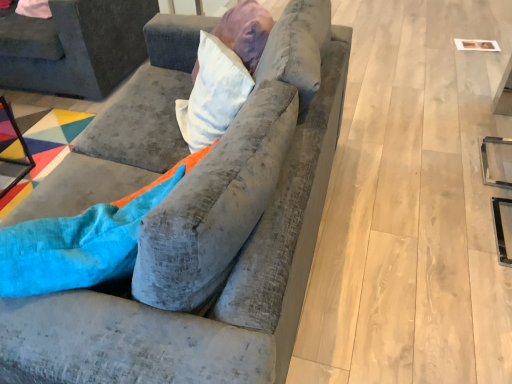
Question: Is velvet gray couch at center, placed as the second studio couch when sorted from left to right, facing towards velvet gray couch at upper left, marked as the 2th studio couch in a right-to-left arrangement?

Choices:
 (A) no
 (B) yes

Answer: (B)

Question: Is velvet gray couch at center, which is counted as the first studio couch, starting from the right, bigger than velvet gray couch at upper left, marked as the 2th studio couch in a right-to-left arrangement?

Choices:
 (A) yes
 (B) no

Answer: (A)

Question: Is velvet gray couch at center, acting as the 1th studio couch starting from the front, with velvet gray couch at upper left, the 1th studio couch from the back?

Choices:
 (A) no
 (B) yes

Answer: (A)

Question: Is velvet gray couch at center, placed as the second studio couch when sorted from left to right, further to the viewer compared to velvet gray couch at upper left, marked as the 2th studio couch in a right-to-left arrangement?

Choices:
 (A) no
 (B) yes

Answer: (A)

Question: Is velvet gray couch at center, the 2th studio couch positioned from the back, located outside velvet gray couch at upper left, the 1th studio couch from the back?

Choices:
 (A) yes
 (B) no

Answer: (A)

Question: From a real-world perspective, is velvet gray couch at center, which is counted as the first studio couch, starting from the right, positioned over velvet gray couch at upper left, marked as the second studio couch in a front-to-back arrangement, based on gravity?

Choices:
 (A) no
 (B) yes

Answer: (B)

Question: Does velvet gray couch at upper left, marked as the second studio couch in a front-to-back arrangement, appear on the right side of velvet gray couch at center, the 2th studio couch positioned from the back?

Choices:
 (A) no
 (B) yes

Answer: (A)

Question: From the image's perspective, does velvet gray couch at upper left, the 1th studio couch from the back, appear lower than velvet gray couch at center, the 2th studio couch positioned from the back?

Choices:
 (A) yes
 (B) no

Answer: (B)

Question: Is velvet gray couch at upper left, which ranks as the first studio couch in left-to-right order, shorter than velvet gray couch at center, the 2th studio couch positioned from the back?

Choices:
 (A) no
 (B) yes

Answer: (B)

Question: Is velvet gray couch at upper left, the 1th studio couch from the back, surrounding velvet gray couch at center, which is counted as the first studio couch, starting from the right?

Choices:
 (A) yes
 (B) no

Answer: (B)

Question: From a real-world perspective, is velvet gray couch at upper left, marked as the second studio couch in a front-to-back arrangement, positioned under velvet gray couch at center, acting as the 1th studio couch starting from the front, based on gravity?

Choices:
 (A) no
 (B) yes

Answer: (B)

Question: Can you confirm if velvet gray couch at upper left, which ranks as the first studio couch in left-to-right order, is bigger than velvet gray couch at center, which is counted as the first studio couch, starting from the right?

Choices:
 (A) yes
 (B) no

Answer: (B)

Question: Considering the positions of velvet gray couch at center, placed as the second studio couch when sorted from left to right, and velvet gray couch at upper left, the 1th studio couch from the back, in the image, is velvet gray couch at center, placed as the second studio couch when sorted from left to right, wider or thinner than velvet gray couch at upper left, the 1th studio couch from the back,?

Choices:
 (A) thin
 (B) wide

Answer: (A)